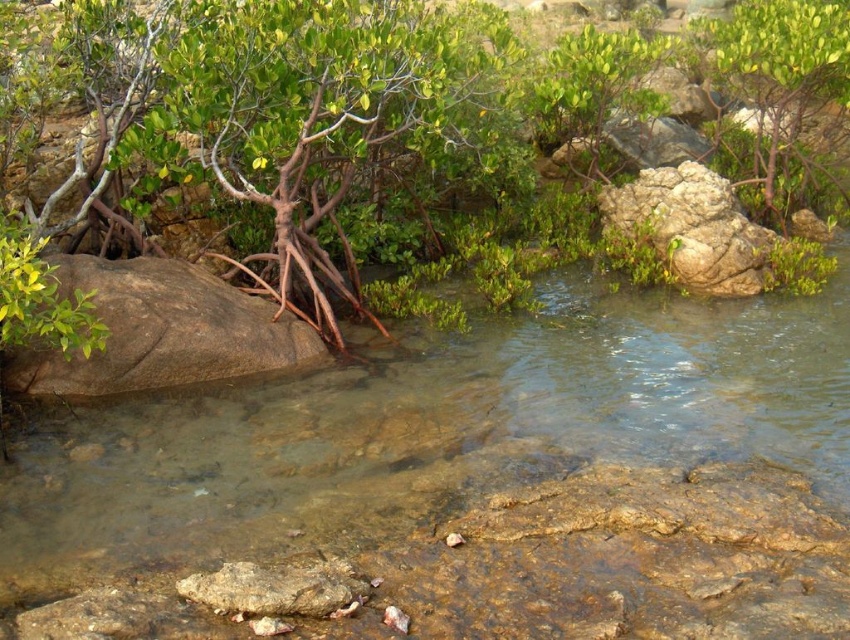
Question: Considering the real-world distances, which object is closest to the green matte tree at upper right?

Choices:
 (A) brown rough boulder at lower left
 (B) clear water at center

Answer: (A)

Question: From the image, what is the correct spatial relationship of clear water at center in relation to brown rough boulder at lower left?

Choices:
 (A) left
 (B) right

Answer: (B)

Question: Does clear water at center have a lesser width compared to green matte tree at upper right?

Choices:
 (A) yes
 (B) no

Answer: (A)

Question: Which object is the farthest from the green matte tree at upper right?

Choices:
 (A) brown rough boulder at lower left
 (B) clear water at center

Answer: (B)

Question: Among these objects, which one is nearest to the camera?

Choices:
 (A) green matte tree at upper right
 (B) clear water at center

Answer: (B)

Question: Does clear water at center appear over green matte tree at upper right?

Choices:
 (A) no
 (B) yes

Answer: (A)